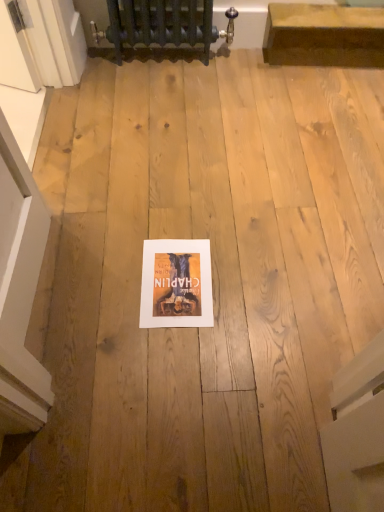
The height and width of the screenshot is (512, 384). I want to click on vacant area situated to the left side of matte paper poster at center, so click(109, 278).